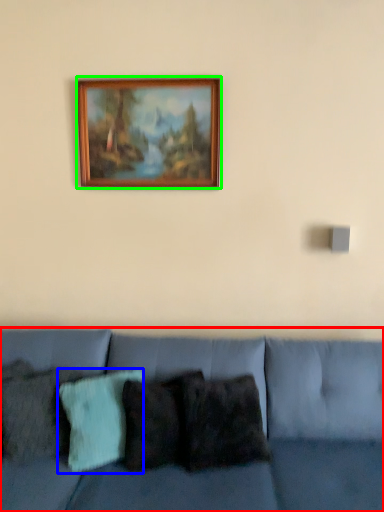
Question: Considering the real-world distances, which object is closest to studio couch (highlighted by a red box)? pillow (highlighted by a blue box) or picture frame (highlighted by a green box).

Choices:
 (A) pillow
 (B) picture frame

Answer: (A)